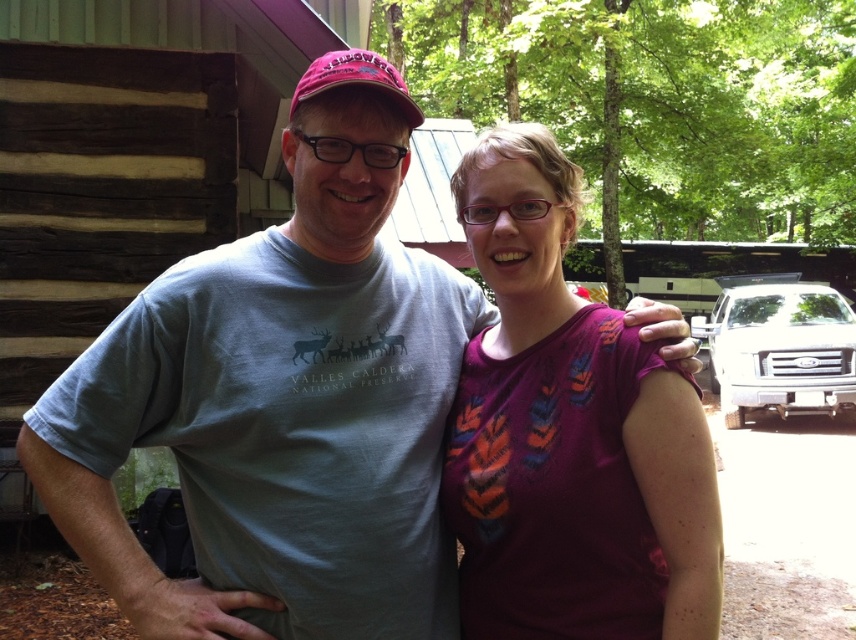
Based on the photo, who is shorter, light blue cotton t-shirt at center or purple printed shirt at center?

purple printed shirt at center

Is point (135, 566) positioned behind point (591, 620)?

Yes, point (135, 566) is behind point (591, 620).

Is point (144, 371) farther from viewer compared to point (593, 586)?

Yes, point (144, 371) is behind point (593, 586).

I want to click on light blue cotton t-shirt at center, so click(x=281, y=401).